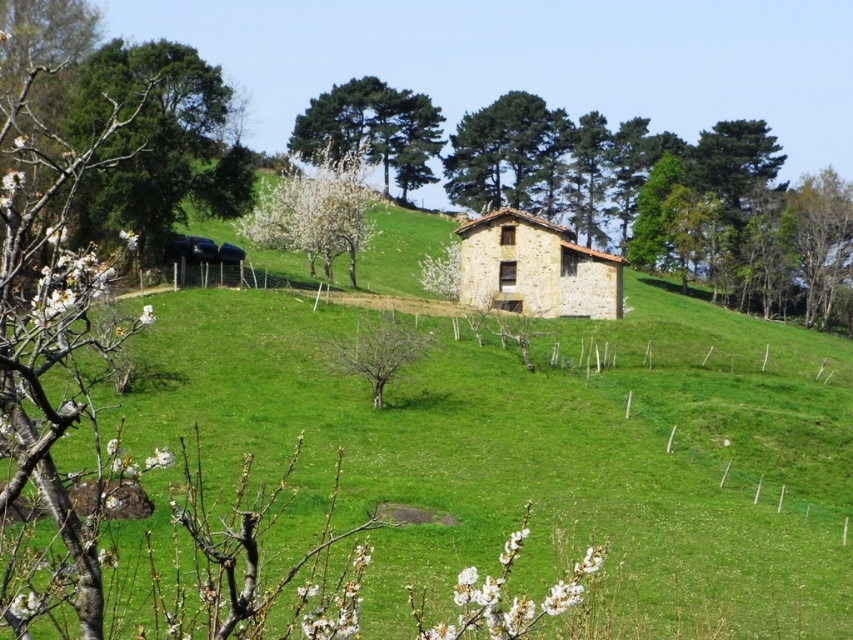
Is green leafy tree at left to the right of bare wood tree at center from the viewer's perspective?

No, green leafy tree at left is not to the right of bare wood tree at center.

Is point (117, 88) behind point (370, 368)?

Yes, point (117, 88) is farther from viewer.

Find the location of a particular element. green leafy tree at left is located at coordinates (154, 141).

Who is positioned more to the right, green leafy trees at upper center or bare wood tree at center?

Positioned to the right is bare wood tree at center.

Which is below, green leafy trees at upper center or bare wood tree at center?

Positioned lower is bare wood tree at center.

Find the location of a particular element. The width and height of the screenshot is (853, 640). green leafy trees at upper center is located at coordinates (372, 129).

Based on the photo, can you confirm if green leafy tree at left is bigger than green leafy trees at upper center?

Actually, green leafy tree at left might be smaller than green leafy trees at upper center.

Does green leafy tree at left appear on the right side of green leafy trees at upper center?

No, green leafy tree at left is not to the right of green leafy trees at upper center.

I want to click on green leafy tree at left, so click(x=154, y=141).

At what (x,y) coordinates should I click in order to perform the action: click on green leafy tree at left. Please return your answer as a coordinate pair (x, y). Image resolution: width=853 pixels, height=640 pixels. Looking at the image, I should click on (154, 141).